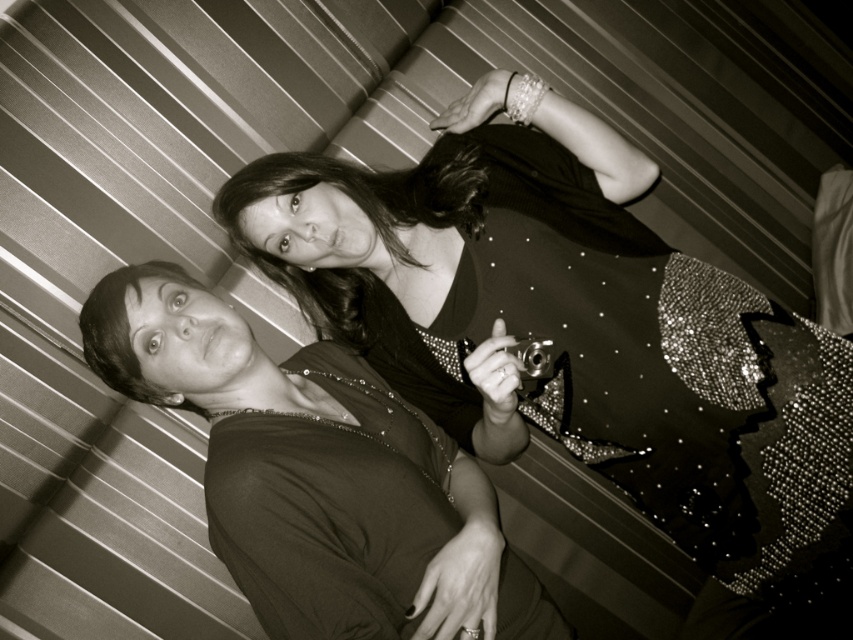
You are a photographer setting up for a photoshoot and need to position two models wearing the shiny sequined dress at center and the matte black dress at center. According to the scene, which dress is positioned closer to the camera?

The shiny sequined dress at center is closer to the camera because the matte black dress at center is behind it.

You are a fashion designer observing the two dresses in the image. The shiny sequined dress at center and the matte black dress at center. Which dress is taller?

The shiny sequined dress at center is taller than the matte black dress at center.